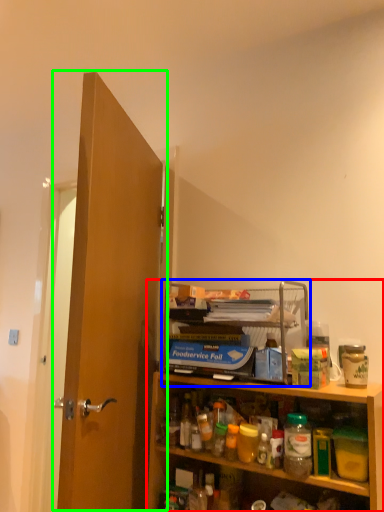
Question: Based on their relative distances, which object is farther from cabinetry (highlighted by a red box)? Choose from shelf (highlighted by a blue box) and door (highlighted by a green box).

Choices:
 (A) shelf
 (B) door

Answer: (B)